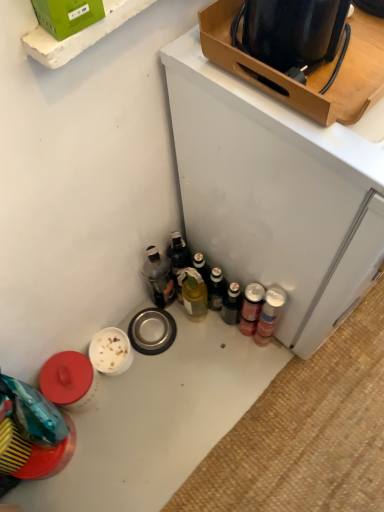
At what (x,y) coordinates should I click in order to perform the action: click on metallic silver can at lower right, the 4th bottle in the left-to-right sequence. Please return your answer as a coordinate pair (x, y). Looking at the image, I should click on (269, 314).

I want to click on green cardboard box at upper left, the first box positioned from the left, so click(67, 15).

You are a GUI agent. You are given a task and a screenshot of the screen. Output one action in this format:
    pyautogui.click(x=<x>, y=<y>)
    Task: Click on the translucent plastic bottle at center, placed as the 2th bottle when sorted from left to right
    Image resolution: width=384 pixels, height=512 pixels.
    Given the screenshot: What is the action you would take?
    click(178, 259)

Describe the element at coordinates (251, 308) in the screenshot. I see `metallic silver can at lower right` at that location.

The image size is (384, 512). Find the location of `white glossy table at lower left`. white glossy table at lower left is located at coordinates (158, 420).

Locate an element on the screen. metallic silver canisters at lower right is located at coordinates (277, 193).

Looking at this image, from a real-world perspective, is translucent glass bottle at center, which is the 3th bottle from left to right, located beneath green cardboard box at upper left, the first box positioned from the left?

Correct, in the physical world, translucent glass bottle at center, which is the 3th bottle from left to right, is lower than green cardboard box at upper left, the first box positioned from the left.

From the image's perspective, between translucent glass bottle at center, which is the 3th bottle from left to right, and green cardboard box at upper left, acting as the second box starting from the right, which one is located above?

green cardboard box at upper left, acting as the second box starting from the right.

In the scene shown: Which point is more forward, (97, 0) or (265, 342)?

The point (97, 0) is in front.

Between green cardboard box at upper left, placed as the 2th box when sorted from back to front, and metallic silver can at lower right, the 4th bottle in the left-to-right sequence, which one has more height?

With more height is metallic silver can at lower right, the 4th bottle in the left-to-right sequence.

From the image's perspective, is green cardboard box at upper left, the first box positioned from the left, over metallic silver can at lower right, which ranks as the 1th bottle in right-to-left order?

Yes, from the image's perspective, green cardboard box at upper left, the first box positioned from the left, is over metallic silver can at lower right, which ranks as the 1th bottle in right-to-left order.

Based on the photo, choose the correct answer: Is green cardboard box at upper left, placed as the 2th box when sorted from back to front, inside metallic silver can at lower right, the 4th bottle in the left-to-right sequence, or outside it?

green cardboard box at upper left, placed as the 2th box when sorted from back to front, is spatially situated outside metallic silver can at lower right, the 4th bottle in the left-to-right sequence.

Between translucent plastic bottle at center, placed as the 2th bottle when sorted from left to right, and green cardboard box at upper left, placed as the 2th box when sorted from back to front, which one has larger width?

green cardboard box at upper left, placed as the 2th box when sorted from back to front, is wider.

You are a GUI agent. You are given a task and a screenshot of the screen. Output one action in this format:
    pyautogui.click(x=<x>, y=<y>)
    Task: Click on the box on the left of translucent plastic bottle at center, placed as the 2th bottle when sorted from left to right
    The width and height of the screenshot is (384, 512).
    Given the screenshot: What is the action you would take?
    pyautogui.click(x=67, y=15)

From the image's perspective, would you say translucent plastic bottle at center, placed as the 2th bottle when sorted from left to right, is positioned over green cardboard box at upper left, placed as the 2th box when sorted from back to front?

No, from the image's perspective, translucent plastic bottle at center, placed as the 2th bottle when sorted from left to right, is not over green cardboard box at upper left, placed as the 2th box when sorted from back to front.

Who is smaller, metallic silver can at lower right, which ranks as the 1th bottle in right-to-left order, or green cardboard box at upper left, which is counted as the first box, starting from the front?

metallic silver can at lower right, which ranks as the 1th bottle in right-to-left order.

Are metallic silver can at lower right, which ranks as the 1th bottle in right-to-left order, and green cardboard box at upper left, placed as the 2th box when sorted from back to front, located far from each other?

metallic silver can at lower right, which ranks as the 1th bottle in right-to-left order, is near green cardboard box at upper left, placed as the 2th box when sorted from back to front, not far away.

In terms of height, does metallic silver can at lower right, which ranks as the 1th bottle in right-to-left order, look taller or shorter compared to green cardboard box at upper left, which is counted as the first box, starting from the front?

In the image, metallic silver can at lower right, which ranks as the 1th bottle in right-to-left order, appears to be taller than green cardboard box at upper left, which is counted as the first box, starting from the front.

Locate an element on the screen. The image size is (384, 512). the 1st bottle positioned below the green cardboard box at upper left, the first box positioned from the left (from a real-world perspective) is located at coordinates (269, 314).

Which object is positioned more to the right, translucent plastic bottle at center, the third bottle viewed from the right, or translucent glass bottle at center, which is the 3th bottle from left to right?

From the viewer's perspective, translucent glass bottle at center, which is the 3th bottle from left to right, appears more on the right side.

Which bottle is the 1st one when counting from the left side of the translucent glass bottle at center, the second bottle when ordered from right to left? Please provide its 2D coordinates.

[(178, 259)]

Does point (168, 252) lie in front of point (190, 278)?

No, (168, 252) is behind (190, 278).

Is translucent glass bottle at center, the 4th bottle positioned from the right, to the left of translucent plastic bottle at center, the third bottle viewed from the right, from the viewer's perspective?

Correct, you'll find translucent glass bottle at center, the 4th bottle positioned from the right, to the left of translucent plastic bottle at center, the third bottle viewed from the right.

Considering the sizes of objects translucent glass bottle at center, the 4th bottle positioned from the right, and translucent plastic bottle at center, placed as the 2th bottle when sorted from left to right, in the image provided, who is taller, translucent glass bottle at center, the 4th bottle positioned from the right, or translucent plastic bottle at center, placed as the 2th bottle when sorted from left to right,?

translucent glass bottle at center, the 4th bottle positioned from the right.

Based on their sizes in the image, would you say translucent glass bottle at center, marked as the 1th bottle in a left-to-right arrangement, is bigger or smaller than translucent plastic bottle at center, placed as the 2th bottle when sorted from left to right?

In the image, translucent glass bottle at center, marked as the 1th bottle in a left-to-right arrangement, appears to be larger than translucent plastic bottle at center, placed as the 2th bottle when sorted from left to right.

Does translucent glass bottle at center, the 4th bottle positioned from the right, turn towards translucent plastic bottle at center, the third bottle viewed from the right?

No, translucent glass bottle at center, the 4th bottle positioned from the right, is not facing towards translucent plastic bottle at center, the third bottle viewed from the right.

Is metallic silver can at lower right to the left of metallic silver can at lower right, the 4th bottle in the left-to-right sequence, from the viewer's perspective?

Correct, you'll find metallic silver can at lower right to the left of metallic silver can at lower right, the 4th bottle in the left-to-right sequence.

Is point (250, 298) closer to camera compared to point (257, 343)?

Yes, point (250, 298) is closer to viewer.

Looking at the image, does metallic silver can at lower right seem bigger or smaller compared to metallic silver can at lower right, the 4th bottle in the left-to-right sequence?

In the image, metallic silver can at lower right appears to be smaller than metallic silver can at lower right, the 4th bottle in the left-to-right sequence.

You are a GUI agent. You are given a task and a screenshot of the screen. Output one action in this format:
    pyautogui.click(x=<x>, y=<y>)
    Task: Click on the 2nd box positioned above the translucent glass bottle at center, which is the 3th bottle from left to right (from a real-world perspective)
    
    Given the screenshot: What is the action you would take?
    pyautogui.click(x=67, y=15)

At what (x,y) coordinates should I click in order to perform the action: click on the 1st bottle directly beneath the green cardboard box at upper left, acting as the second box starting from the right (from a real-world perspective). Please return your answer as a coordinate pair (x, y). Image resolution: width=384 pixels, height=512 pixels. Looking at the image, I should click on (269, 314).

Considering their positions, is metallic silver canisters at lower right positioned further to translucent glass bottle at center, the 4th bottle positioned from the right, than metallic silver can at lower right, which ranks as the 1th bottle in right-to-left order?

metallic silver canisters at lower right is positioned further to the anchor translucent glass bottle at center, the 4th bottle positioned from the right.

Looking at the image, which one is located closer to metallic silver can at lower right, translucent glass bottle at center, the 4th bottle positioned from the right, or metallic silver can at lower right, which ranks as the 1th bottle in right-to-left order?

The object closer to metallic silver can at lower right is metallic silver can at lower right, which ranks as the 1th bottle in right-to-left order.

Based on their spatial positions, is translucent glass bottle at center, marked as the 1th bottle in a left-to-right arrangement, or metallic silver can at lower right further from white glossy table at lower left?

The object further to white glossy table at lower left is translucent glass bottle at center, marked as the 1th bottle in a left-to-right arrangement.

Considering their positions, is translucent plastic bottle at center, the third bottle viewed from the right, positioned closer to metallic silver canisters at lower right than translucent glass bottle at center, the 4th bottle positioned from the right?

Based on the image, translucent plastic bottle at center, the third bottle viewed from the right, appears to be nearer to metallic silver canisters at lower right.

Estimate the real-world distances between objects in this image. Which object is further from metallic silver can at lower right, the 4th bottle in the left-to-right sequence, green cardboard box at upper left, acting as the second box starting from the right, or wooden tray at upper right, which is the 2th box in front-to-back order?

Among the two, green cardboard box at upper left, acting as the second box starting from the right, is located further to metallic silver can at lower right, the 4th bottle in the left-to-right sequence.

From the image, which object appears to be nearer to green cardboard box at upper left, placed as the 2th box when sorted from back to front, translucent glass bottle at center, the second bottle when ordered from right to left, or metallic silver can at lower right?

metallic silver can at lower right is positioned closer to the anchor green cardboard box at upper left, placed as the 2th box when sorted from back to front.

From the image, which object appears to be farther from white glossy table at lower left, metallic silver can at lower right, which ranks as the 1th bottle in right-to-left order, or green cardboard box at upper left, placed as the 2th box when sorted from back to front?

green cardboard box at upper left, placed as the 2th box when sorted from back to front, is positioned further to the anchor white glossy table at lower left.

Considering their positions, is wooden tray at upper right, the first box from the back, positioned further to metallic silver can at lower right than translucent glass bottle at center, the second bottle when ordered from right to left?

Among the two, wooden tray at upper right, the first box from the back, is located further to metallic silver can at lower right.

At what (x,y) coordinates should I click in order to perform the action: click on beverage between green cardboard box at upper left, acting as the second box starting from the right, and white glossy table at lower left, in the vertical direction. Please return your answer as a coordinate pair (x, y). The height and width of the screenshot is (512, 384). Looking at the image, I should click on click(251, 308).

Where is `appliance positioned between green cardboard box at upper left, acting as the second box starting from the right, and translucent glass bottle at center, the second bottle when ordered from right to left, from near to far`? The image size is (384, 512). appliance positioned between green cardboard box at upper left, acting as the second box starting from the right, and translucent glass bottle at center, the second bottle when ordered from right to left, from near to far is located at coordinates (277, 193).

The height and width of the screenshot is (512, 384). I want to click on appliance positioned between wooden tray at upper right, positioned as the 2th box in left-to-right order, and translucent glass bottle at center, the second bottle when ordered from right to left, from near to far, so click(x=277, y=193).

Identify the location of beverage between translucent glass bottle at center, the second bottle when ordered from right to left, and white glossy table at lower left from top to bottom. This screenshot has width=384, height=512. (251, 308).